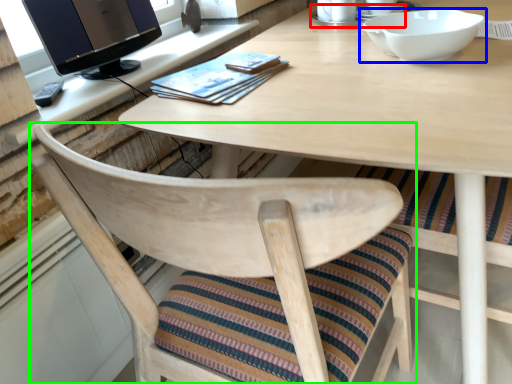
Question: Based on their relative distances, which object is farther from saucer (highlighted by a red box)? Choose from bowl (highlighted by a blue box) and chair (highlighted by a green box).

Choices:
 (A) bowl
 (B) chair

Answer: (B)